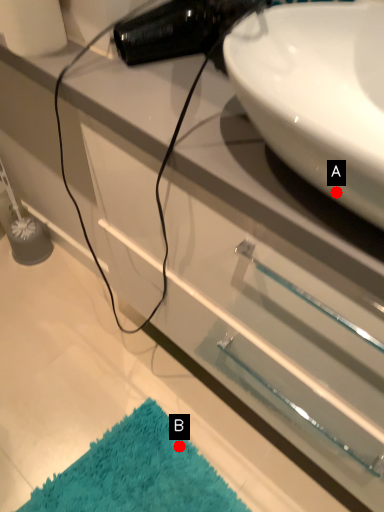
Question: Two points are circled on the image, labeled by A and B beside each circle. Among these points, which one is farthest from the camera?

Choices:
 (A) A is further
 (B) B is further

Answer: (B)